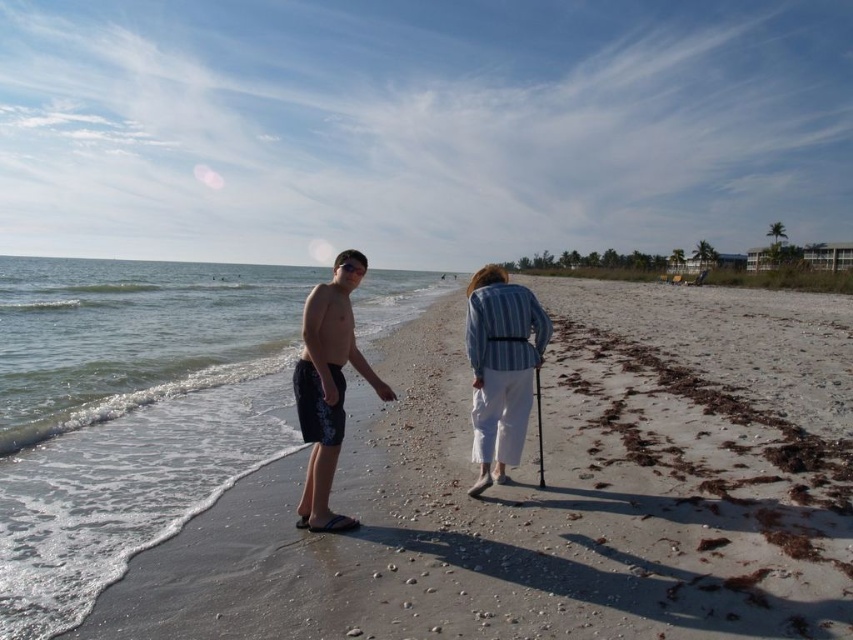
Question: Does clear water at shore left appear on the left side of striped fabric cane at center?

Choices:
 (A) no
 (B) yes

Answer: (B)

Question: Which of the following is the closest to the observer?

Choices:
 (A) (311, 310)
 (B) (529, 401)
 (C) (96, 300)

Answer: (A)

Question: Which of the following is the farthest from the observer?

Choices:
 (A) (747, 342)
 (B) (486, 397)
 (C) (239, 371)

Answer: (A)

Question: Is light beige sand at lower left behind clear water at shore left?

Choices:
 (A) yes
 (B) no

Answer: (B)

Question: Which object appears farthest from the camera in this image?

Choices:
 (A) striped fabric cane at center
 (B) dark blue swim trunks at left
 (C) light beige sand at lower left
 (D) clear water at shore left

Answer: (A)

Question: From the image, what is the correct spatial relationship of striped fabric cane at center in relation to dark blue swim trunks at left?

Choices:
 (A) above
 (B) below

Answer: (A)